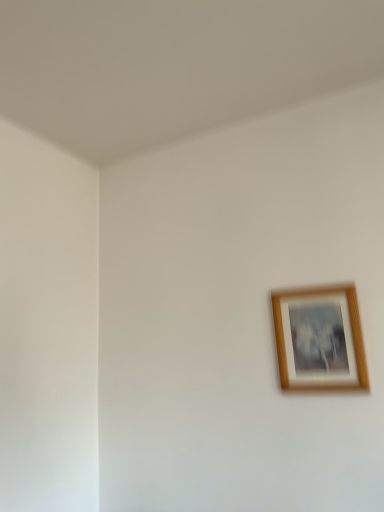
The image size is (384, 512). Describe the element at coordinates (319, 339) in the screenshot. I see `wooden picture frame at upper right` at that location.

What is the approximate height of wooden picture frame at upper right?

wooden picture frame at upper right is 14.35 inches in height.

Image resolution: width=384 pixels, height=512 pixels. I want to click on wooden picture frame at upper right, so click(319, 339).

Locate an element on the screen. wooden picture frame at upper right is located at coordinates (319, 339).